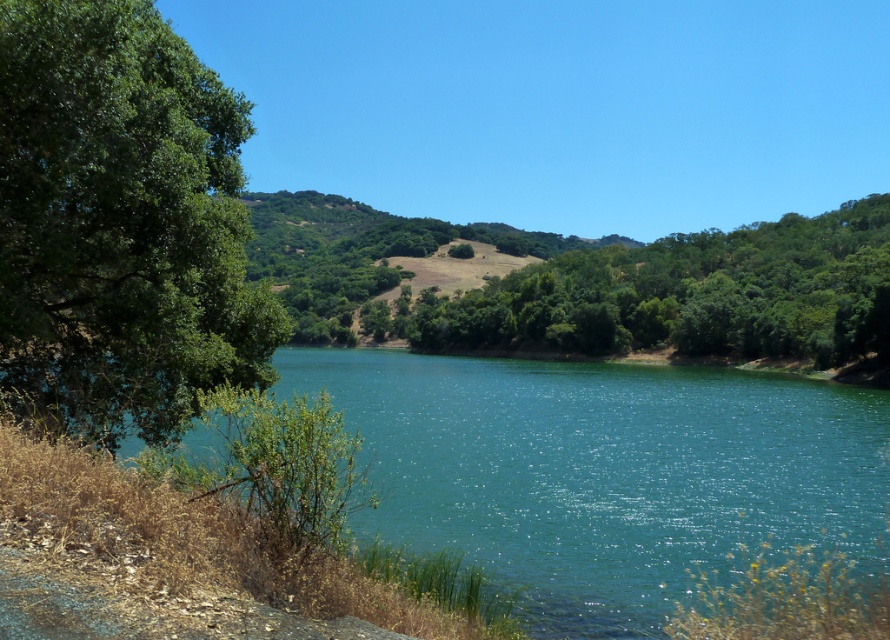
You are standing at the edge of the lake and see the green leafy tree at center and the green leafy hillside at center. Which object is positioned to the right side from your viewpoint?

The green leafy tree at center is positioned to the right of the green leafy hillside at center.

You are planning to build a small garden in the area shown in the image. Which object, the teal glossy water at center or the green leafy hillside at center, has more available space for planting?

The green leafy hillside at center has more available space for planting since it occupies more area than the teal glossy water at center.